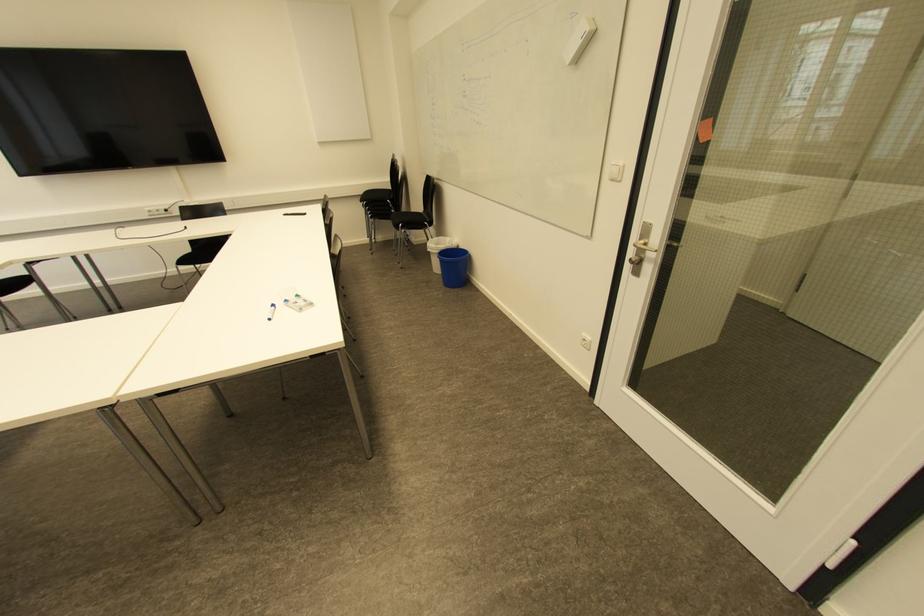
The location [439,249] corresponds to which object?

It refers to a white trash can.